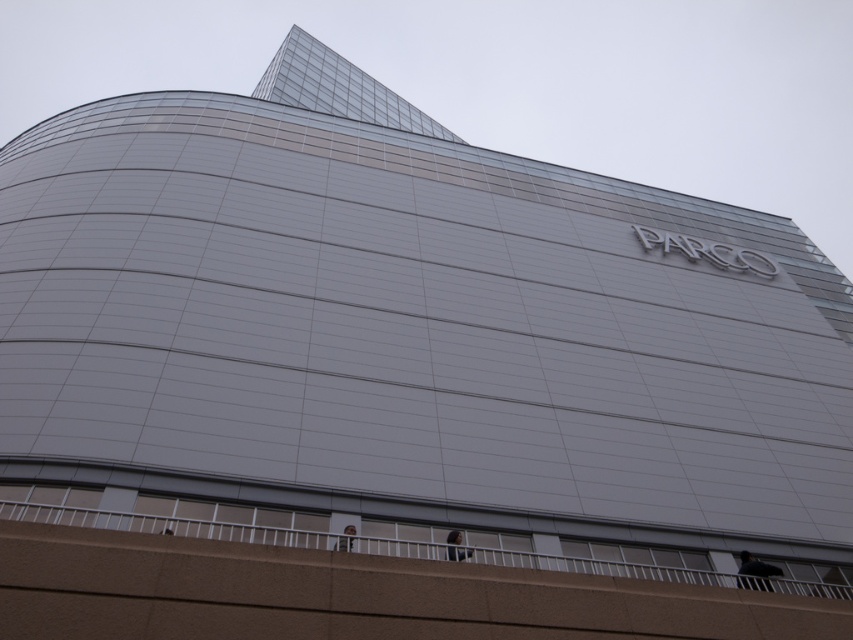
Between light brown hair at lower center and light brown fabric at lower center, which one is positioned lower?

light brown hair at lower center

Can you confirm if light brown hair at lower center is positioned below light brown fabric at lower center?

Yes.

The image size is (853, 640). What are the coordinates of `light brown hair at lower center` in the screenshot? It's located at (456, 547).

Which is above, dark gray fabric at lower right or light brown fabric at lower center?

light brown fabric at lower center is above.

Does dark gray fabric at lower right appear on the right side of light brown fabric at lower center?

Yes, dark gray fabric at lower right is to the right of light brown fabric at lower center.

Describe the element at coordinates (755, 572) in the screenshot. The image size is (853, 640). I see `dark gray fabric at lower right` at that location.

At what (x,y) coordinates should I click in order to perform the action: click on dark gray fabric at lower right. Please return your answer as a coordinate pair (x, y). Looking at the image, I should click on (755, 572).

Based on the photo, does dark gray fabric at lower right have a smaller size compared to light brown hair at lower center?

No, dark gray fabric at lower right is not smaller than light brown hair at lower center.

What do you see at coordinates (755, 572) in the screenshot? This screenshot has width=853, height=640. I see `dark gray fabric at lower right` at bounding box center [755, 572].

Between point (769, 566) and point (459, 545), which one is positioned behind?

The point (769, 566) is more distant.

At what (x,y) coordinates should I click in order to perform the action: click on dark gray fabric at lower right. Please return your answer as a coordinate pair (x, y). Looking at the image, I should click on (755, 572).